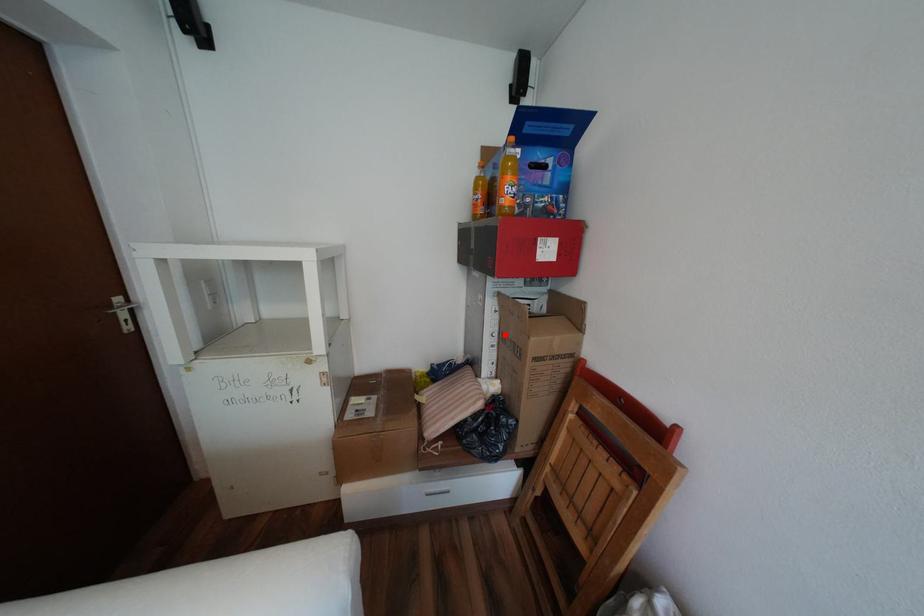
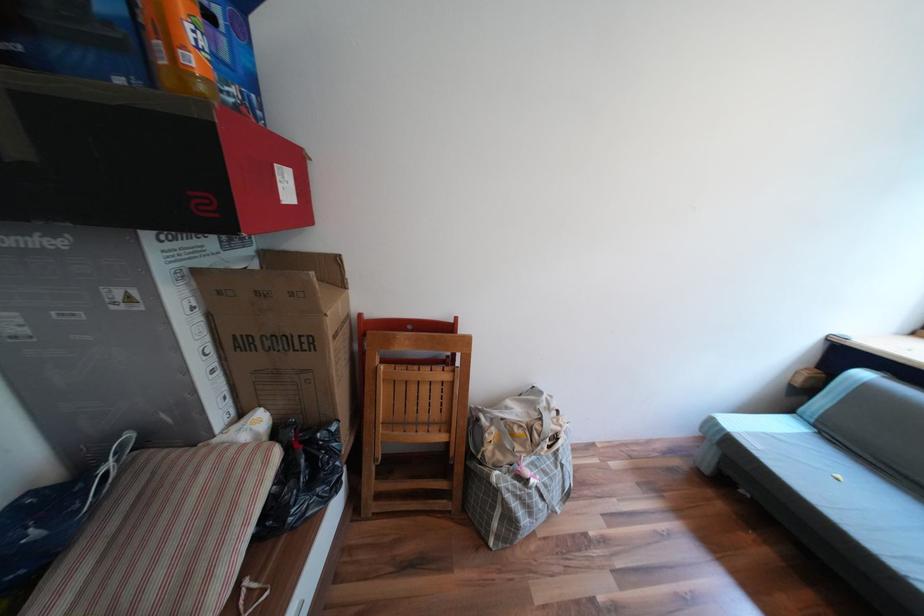
The point at the highlighted location is marked in the first image. Where is the corresponding point in the second image?

(219, 349)